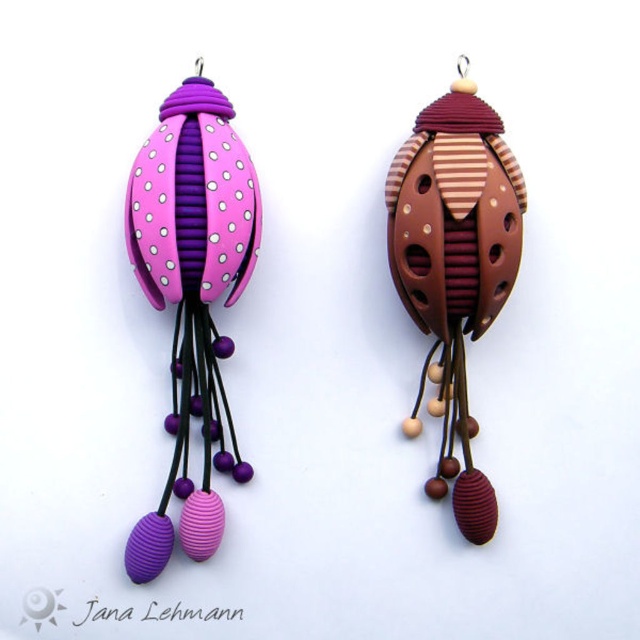
Question: Which point appears closest to the camera in this image?

Choices:
 (A) (400, 173)
 (B) (200, 307)

Answer: (A)

Question: Is matte purple polymer clay earring at left positioned behind brown striped polymer clay earring at center?

Choices:
 (A) no
 (B) yes

Answer: (A)

Question: Is matte purple polymer clay earring at left to the left of brown striped polymer clay earring at center from the viewer's perspective?

Choices:
 (A) no
 (B) yes

Answer: (B)

Question: Can you confirm if matte purple polymer clay earring at left is positioned above brown striped polymer clay earring at center?

Choices:
 (A) no
 (B) yes

Answer: (A)

Question: Which object is closer to the camera taking this photo?

Choices:
 (A) matte purple polymer clay earring at left
 (B) brown striped polymer clay earring at center

Answer: (A)